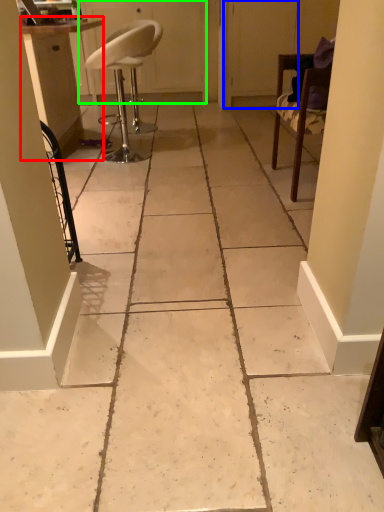
Question: Which object is positioned farthest from cabinetry (highlighted by a red box)? Select from screen door (highlighted by a blue box) and screen door (highlighted by a green box).

Choices:
 (A) screen door
 (B) screen door

Answer: (A)